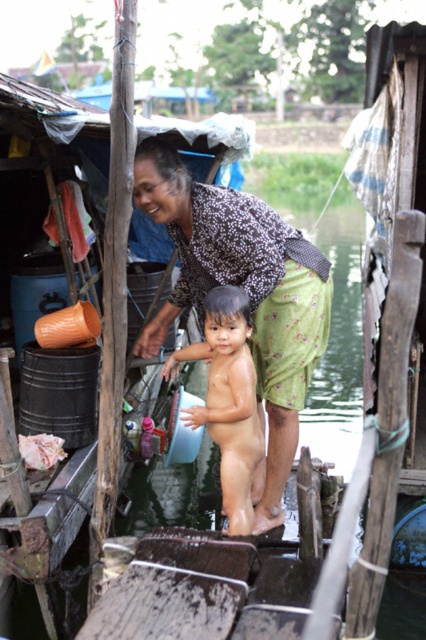
Looking at this image, is printed fabric shirt at center above smooth skin baby at center?

Yes, printed fabric shirt at center is above smooth skin baby at center.

The width and height of the screenshot is (426, 640). Describe the element at coordinates (247, 291) in the screenshot. I see `printed fabric shirt at center` at that location.

This screenshot has width=426, height=640. I want to click on printed fabric shirt at center, so click(247, 291).